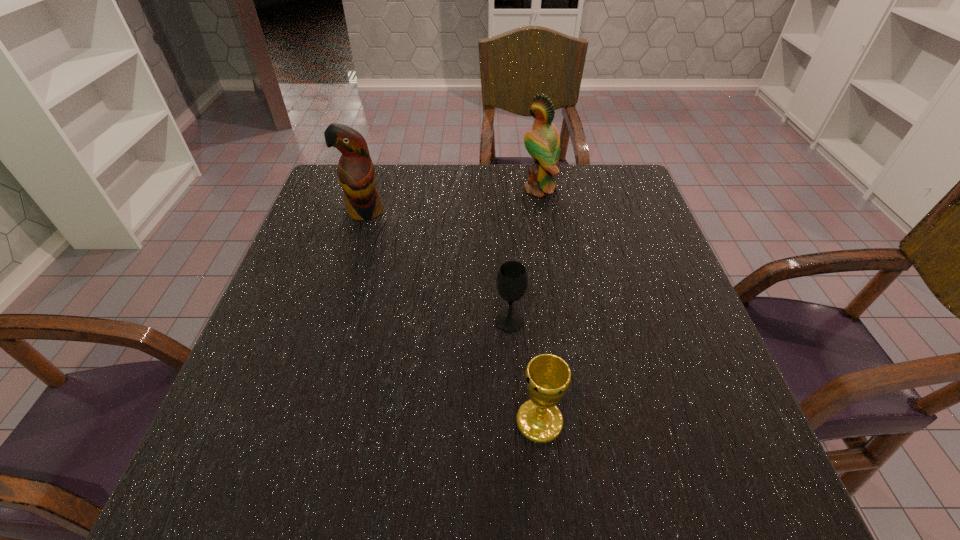
Identify the location of empty space between the wineglass and the right parrot. The width and height of the screenshot is (960, 540). (524, 255).

Identify the location of free space between the right parrot and the nearest object. (540, 305).

Locate an element on the screen. free space between the right parrot and the wineglass is located at coordinates (524, 255).

The width and height of the screenshot is (960, 540). Identify the location of empty space between the chalice and the left parrot. (452, 316).

You are a GUI agent. You are given a task and a screenshot of the screen. Output one action in this format:
    pyautogui.click(x=<x>, y=<y>)
    Task: Click on the empty space between the right parrot and the wineglass
    The height and width of the screenshot is (540, 960).
    Given the screenshot: What is the action you would take?
    pyautogui.click(x=524, y=255)

The image size is (960, 540). In order to click on unoccupied area between the chalice and the wineglass in this screenshot , I will do `click(524, 372)`.

Identify the location of free space between the chalice and the second nearest object. The image size is (960, 540). (524, 372).

In order to click on vacant region between the right parrot and the nearest object in this screenshot , I will do `click(540, 305)`.

You are a GUI agent. You are given a task and a screenshot of the screen. Output one action in this format:
    pyautogui.click(x=<x>, y=<y>)
    Task: Click on the object that stands as the closest to the nearest object
    This screenshot has height=540, width=960.
    Given the screenshot: What is the action you would take?
    pyautogui.click(x=512, y=279)

Identify which object is the closest to the leftmost object. Please provide its 2D coordinates. Your answer should be formatted as a tuple, i.e. [(x, y)], where the tuple contains the x and y coordinates of a point satisfying the conditions above.

[(543, 143)]